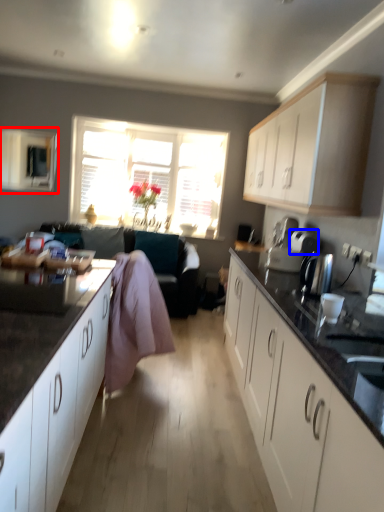
Question: Among these objects, which one is nearest to the camera, window screen (highlighted by a red box) or appliance (highlighted by a blue box)?

Choices:
 (A) window screen
 (B) appliance

Answer: (B)